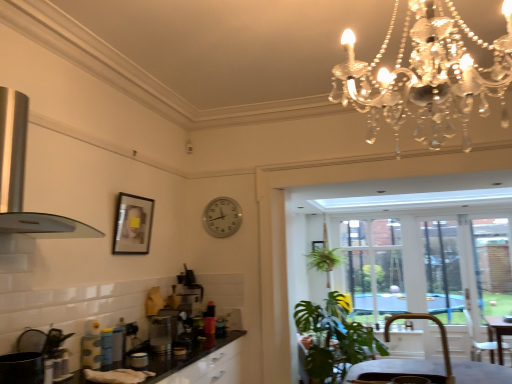
Question: In terms of height, does green leafy plant at center look taller or shorter compared to satin silver toaster at center?

Choices:
 (A) tall
 (B) short

Answer: (A)

Question: Relative to satin silver toaster at center, is green leafy plant at center in front or behind?

Choices:
 (A) front
 (B) behind

Answer: (B)

Question: Which is farther from the silver metallic clock at center?

Choices:
 (A) silver metallic exhaust hood at left
 (B) clear glass door at center, which is the 1th window screen in left-to-right order
 (C) brown leather armchair at lower right
 (D) transparent glass window at center, the 2th window screen in the left-to-right sequence
 (E) matte black picture frame at upper left, the first picture frame from the top

Answer: (D)

Question: Based on their relative distances, which object is nearer to the brown leather armchair at lower right?

Choices:
 (A) silver metallic exhaust hood at left
 (B) matte black picture frame at center, marked as the second picture frame in a front-to-back arrangement
 (C) transparent glass window at center, placed as the 2th window screen when sorted from right to left
 (D) satin silver toaster at center
 (E) transparent glass door at right, which is the 1th window screen in right-to-left order

Answer: (D)